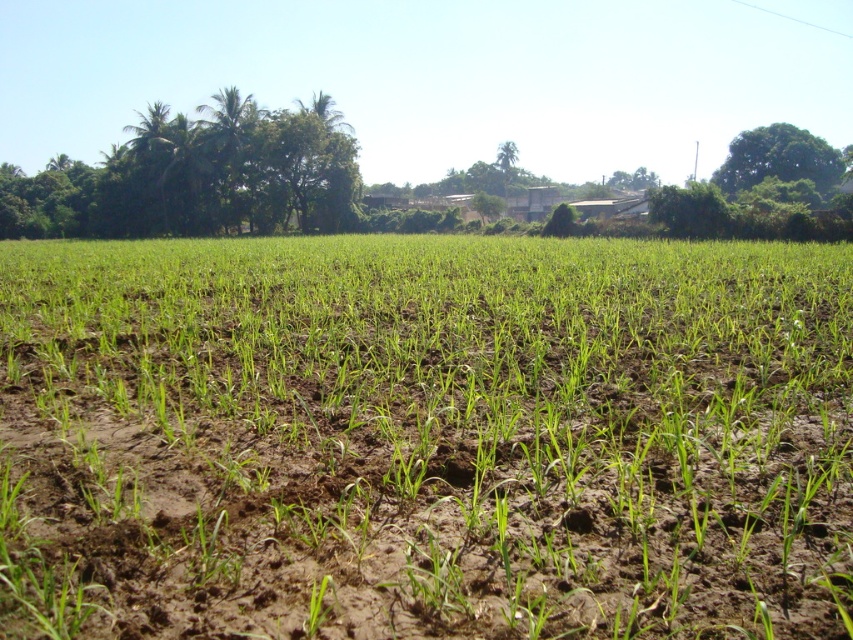
Is green grassy field at center further to the viewer compared to green leafy tree at upper center?

No.

Does green grassy field at center have a lesser height compared to green leafy tree at upper center?

Yes, green grassy field at center is shorter than green leafy tree at upper center.

The height and width of the screenshot is (640, 853). What do you see at coordinates (424, 436) in the screenshot?
I see `green grassy field at center` at bounding box center [424, 436].

I want to click on green grassy field at center, so click(x=424, y=436).

Can you confirm if green grassy field at center is shorter than green leafy trees at upper left?

Yes.

What do you see at coordinates (424, 436) in the screenshot? I see `green grassy field at center` at bounding box center [424, 436].

Who is more forward, [236,568] or [300,225]?

Point [236,568] is more forward.

Identify the location of green grassy field at center. The image size is (853, 640). (424, 436).

Who is positioned more to the right, green leafy trees at upper left or green leafy tree at upper right?

Positioned to the right is green leafy tree at upper right.

Which is above, green leafy trees at upper left or green leafy tree at upper right?

green leafy trees at upper left is higher up.

At what (x,y) coordinates should I click in order to perform the action: click on green leafy trees at upper left. Please return your answer as a coordinate pair (x, y). Looking at the image, I should click on (196, 177).